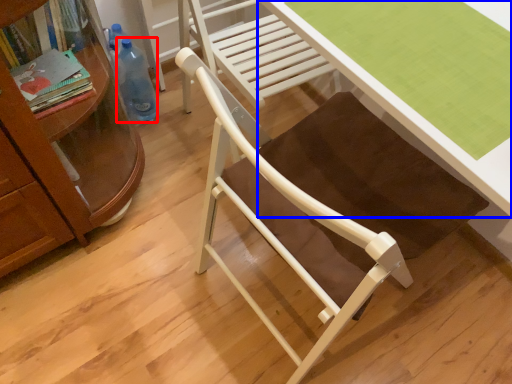
Question: Among these objects, which one is farthest to the camera, bottle (highlighted by a red box) or desk (highlighted by a blue box)?

Choices:
 (A) bottle
 (B) desk

Answer: (A)